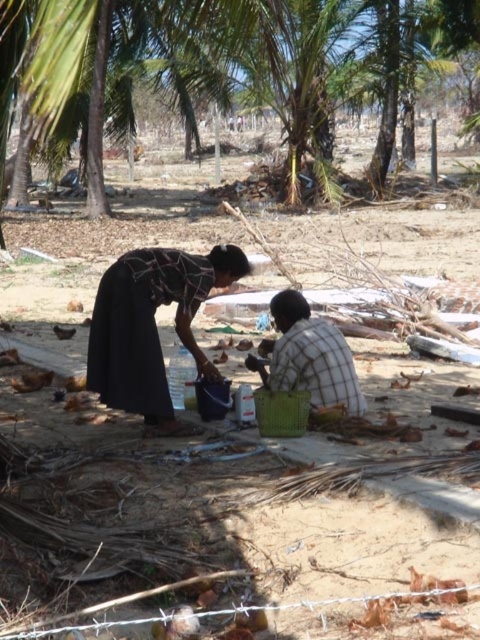
Question: In this image, where is dark fabric skirt at center located relative to checkered fabric shirt at center?

Choices:
 (A) above
 (B) below

Answer: (A)

Question: Can you confirm if dark fabric skirt at center is positioned above checkered fabric shirt at center?

Choices:
 (A) no
 (B) yes

Answer: (B)

Question: Does dark fabric skirt at center appear on the left side of checkered fabric shirt at center?

Choices:
 (A) no
 (B) yes

Answer: (B)

Question: Which point appears closest to the camera in this image?

Choices:
 (A) (187, 273)
 (B) (283, 387)

Answer: (A)

Question: Which of the following is the closest to the observer?

Choices:
 (A) dark fabric skirt at center
 (B) checkered fabric shirt at center

Answer: (A)